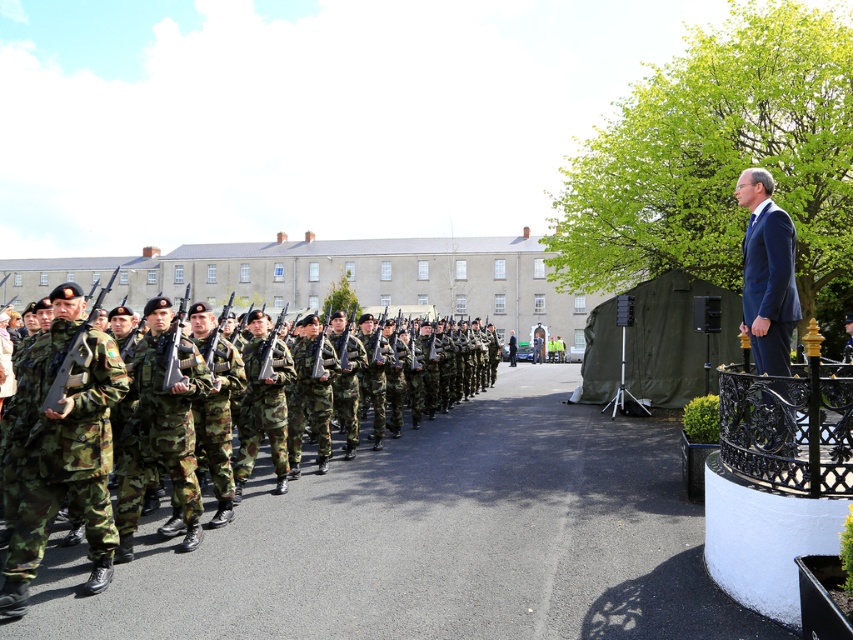
You are a photographer positioned at the center of the courtyard. You need to capture a photo that includes both the camouflage fabric soldiers at left and the camouflage fabric uniform at left. Based on their positions, which one should be placed on the right side of the photo frame?

The camouflage fabric soldiers at left should be placed on the right side of the photo frame since they are positioned to the right of the camouflage fabric uniform at left in the scene.

You are a photographer standing at the center of the courtyard. You want to capture a photo of the camouflage fabric soldiers at left. How far apart are they?

The camouflage fabric soldiers at left are 4.54 meters apart.

You are an observer at the military parade. You notice two people in the crowd wearing different outfits. One is wearing a camouflage fabric uniform at left and another in a dark blue suit at right. Which outfit appears bigger in size?

The camouflage fabric uniform at left has a larger size compared to the dark blue suit at right, so the camouflage fabric uniform at left appears bigger in size.